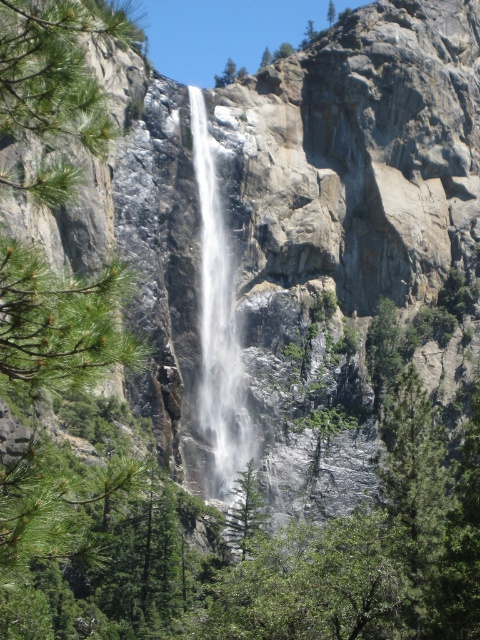
Question: Where is white frothy water at center located in relation to green matte tree at center in the image?

Choices:
 (A) left
 (B) right

Answer: (A)

Question: Can you confirm if green matte tree at center is positioned above green leafy tree at center?

Choices:
 (A) yes
 (B) no

Answer: (B)

Question: Can you confirm if green matte tree at center is bigger than green leafy tree at center?

Choices:
 (A) yes
 (B) no

Answer: (B)

Question: Estimate the real-world distances between objects in this image. Which object is farther from the white frothy water at center?

Choices:
 (A) green leafy tree at center
 (B) green matte tree at center

Answer: (A)

Question: Which of the following is the farthest from the observer?

Choices:
 (A) (237, 333)
 (B) (252, 460)

Answer: (A)

Question: Which of the following is the farthest from the observer?

Choices:
 (A) (228, 257)
 (B) (335, 12)

Answer: (B)